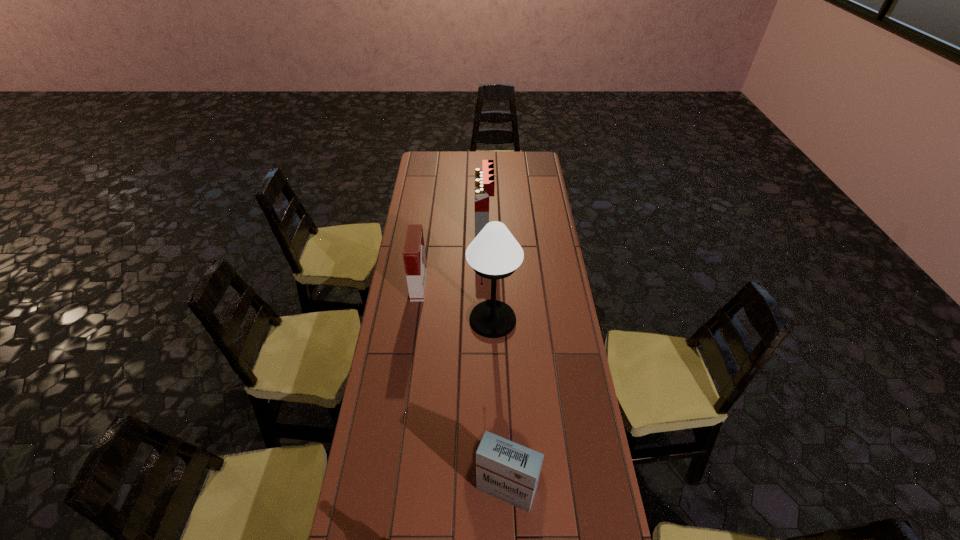
Identify the location of empty space that is in between the leftmost cigarette case and the table lamp. (456, 303).

Where is `empty space that is in between the second nearest cigarette case and the fourth farthest object`? The width and height of the screenshot is (960, 540). empty space that is in between the second nearest cigarette case and the fourth farthest object is located at coordinates (463, 388).

Where is `vacant area that lies between the leftmost cigarette case and the fourth farthest object`? Image resolution: width=960 pixels, height=540 pixels. vacant area that lies between the leftmost cigarette case and the fourth farthest object is located at coordinates (463, 388).

Image resolution: width=960 pixels, height=540 pixels. Identify the location of blank region between the second nearest cigarette case and the tallest object. (456, 303).

Where is `object that stands as the closest to the second nearest cigarette case`? The height and width of the screenshot is (540, 960). object that stands as the closest to the second nearest cigarette case is located at coordinates coord(494,254).

Locate which object ranks fourth in proximity to the second nearest cigarette case. Please provide its 2D coordinates. Your answer should be formatted as a tuple, i.e. [(x, y)], where the tuple contains the x and y coordinates of a point satisfying the conditions above.

[(384, 539)]

Identify which cigarette case is the second nearest to the tallest cigarette case. Please provide its 2D coordinates. Your answer should be formatted as a tuple, i.e. [(x, y)], where the tuple contains the x and y coordinates of a point satisfying the conditions above.

[(506, 470)]

Where is `cigarette case that is the second closest to the tallest object`? cigarette case that is the second closest to the tallest object is located at coordinates (484, 179).

At what (x,y) coordinates should I click in order to perform the action: click on free space that satisfies the following two spatial constraints: 1. on the front-facing side of the leftmost cigarette case; 2. on the right side of the nearest cigarette case. Please return your answer as a coordinate pair (x, y). This screenshot has height=540, width=960. Looking at the image, I should click on (392, 490).

This screenshot has width=960, height=540. Identify the location of vacant area in the image that satisfies the following two spatial constraints: 1. on the front-facing side of the leftmost cigarette case; 2. on the left side of the second nearest object. (392, 490).